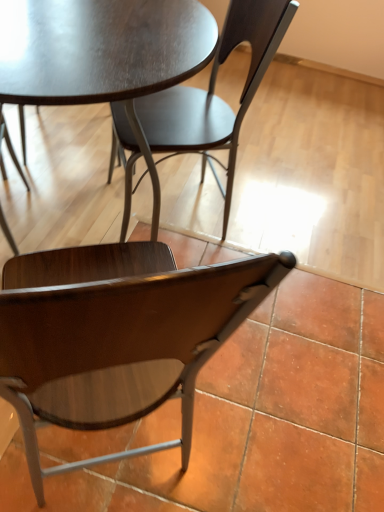
Identify the location of free location to the right of matte dark wood table at center. Image resolution: width=384 pixels, height=512 pixels. (294, 264).